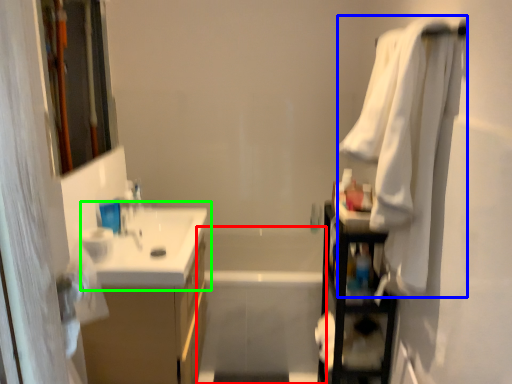
Question: Considering the real-world distances, which object is farthest from bath (highlighted by a red box)? bath towel (highlighted by a blue box) or sink (highlighted by a green box)?

Choices:
 (A) bath towel
 (B) sink

Answer: (A)